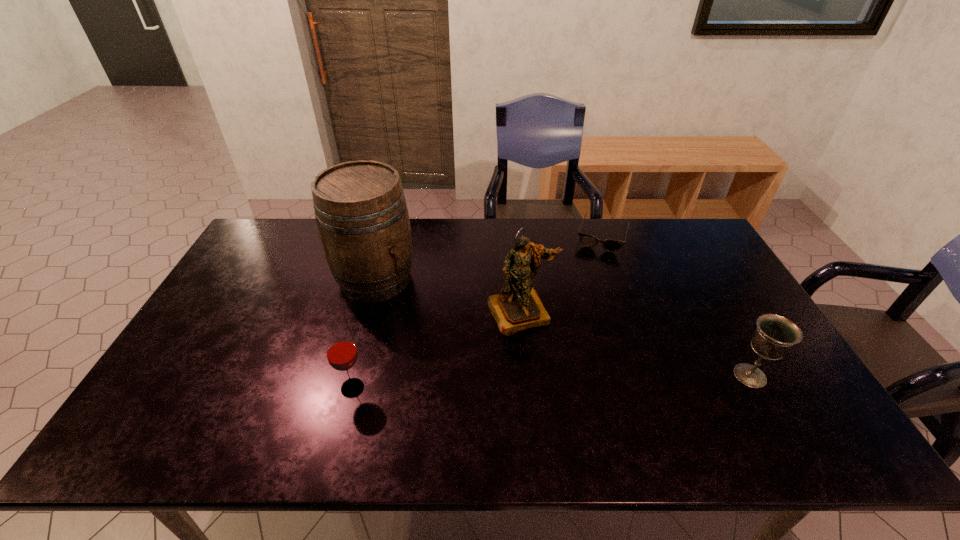
At what (x,y) coordinates should I click in order to perform the action: click on glass present at the near edge. Please return your answer as a coordinate pair (x, y). The width and height of the screenshot is (960, 540). Looking at the image, I should click on (341, 352).

At what (x,y) coordinates should I click in order to perform the action: click on chalice at the near edge. Please return your answer as a coordinate pair (x, y). This screenshot has width=960, height=540. Looking at the image, I should click on (775, 335).

The height and width of the screenshot is (540, 960). In order to click on object positioned at the right edge in this screenshot , I will do `click(775, 335)`.

This screenshot has width=960, height=540. In order to click on object present at the near right corner in this screenshot , I will do `click(775, 335)`.

This screenshot has height=540, width=960. In the image, there is a desktop. What are the coordinates of `free space at the far edge` in the screenshot? It's located at (572, 228).

Find the location of a particular element. free region at the near edge is located at coordinates (434, 388).

This screenshot has width=960, height=540. In the image, there is a desktop. Find the location of `vacant space at the left edge`. vacant space at the left edge is located at coordinates (194, 361).

Identify the location of free location at the right edge of the desktop. This screenshot has height=540, width=960. (752, 360).

At what (x,y) coordinates should I click in order to perform the action: click on empty space between the chalice and the glass. Please return your answer as a coordinate pair (x, y). The width and height of the screenshot is (960, 540). Looking at the image, I should click on (551, 382).

Find the location of a particular element. vacant region between the cider and the glass is located at coordinates (364, 333).